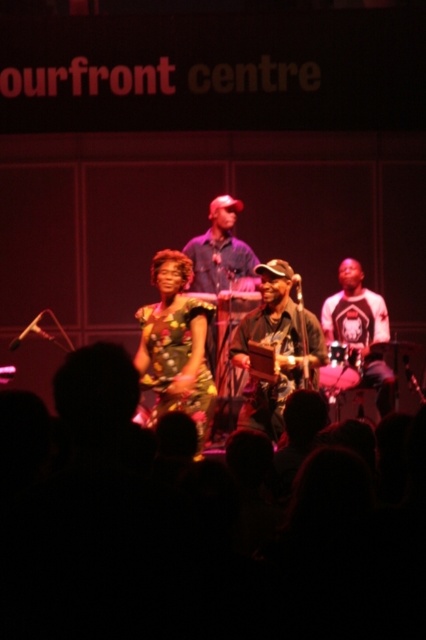
Question: Which of the following is the farthest from the observer?

Choices:
 (A) (134, 360)
 (B) (238, 417)

Answer: (B)

Question: Is printed fabric dress at center bigger than matte black guitar at center?

Choices:
 (A) yes
 (B) no

Answer: (A)

Question: Considering the relative positions of printed fabric dress at center and matte black guitar at center in the image provided, where is printed fabric dress at center located with respect to matte black guitar at center?

Choices:
 (A) below
 (B) above

Answer: (A)

Question: Which object is closer to the camera taking this photo?

Choices:
 (A) matte black guitar at center
 (B) printed fabric dress at center

Answer: (B)

Question: Can you confirm if printed fabric dress at center is positioned to the left of matte black guitar at center?

Choices:
 (A) yes
 (B) no

Answer: (A)